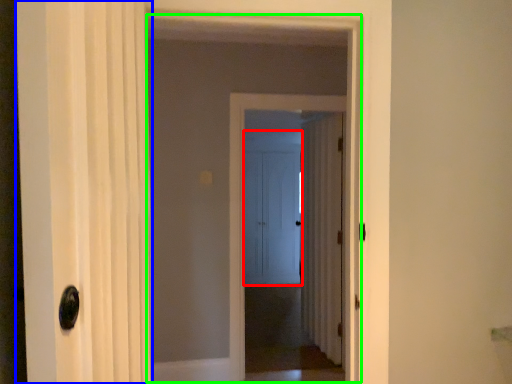
Question: Which object is positioned closest to door (highlighted by a red box)? Select from door (highlighted by a blue box) and elevator (highlighted by a green box).

Choices:
 (A) door
 (B) elevator

Answer: (B)